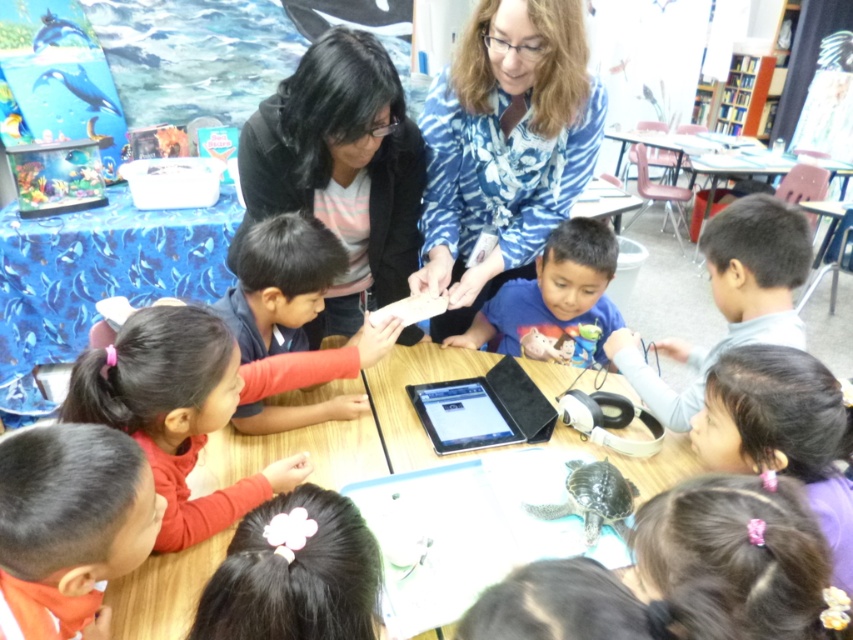
Does blue matte shirt at center have a lesser height compared to black plastic tablet at center?

In fact, blue matte shirt at center may be taller than black plastic tablet at center.

Can you confirm if blue matte shirt at center is bigger than black plastic tablet at center?

Yes.

Between point (554, 314) and point (419, 419), which one is positioned in front?

Point (419, 419) is more forward.

Find the location of `blue matte shirt at center`. blue matte shirt at center is located at coordinates (553, 298).

Does black hair at lower center appear over black plastic tablet at center?

Incorrect, black hair at lower center is not positioned above black plastic tablet at center.

The height and width of the screenshot is (640, 853). I want to click on black hair at lower center, so pyautogui.click(x=294, y=573).

You are a GUI agent. You are given a task and a screenshot of the screen. Output one action in this format:
    pyautogui.click(x=<x>, y=<y>)
    Task: Click on the black hair at lower center
    The height and width of the screenshot is (640, 853).
    Given the screenshot: What is the action you would take?
    pyautogui.click(x=294, y=573)

Is point (341, 449) more distant than point (490, 308)?

No, it is in front of (490, 308).

From the picture: Can you confirm if wooden table at center is bigger than blue matte shirt at center?

Yes.

Identify the location of wooden table at center. The width and height of the screenshot is (853, 640). (350, 426).